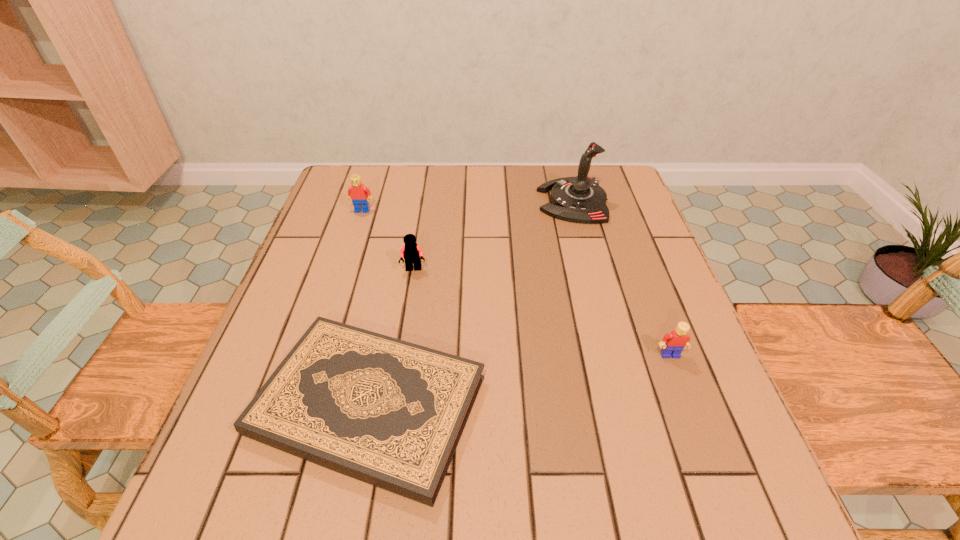
Locate an element on the screen. free spot between the rightmost Lego and the farthest Lego is located at coordinates (516, 282).

Where is `unoccupied position between the hardback book and the nearest Lego`? unoccupied position between the hardback book and the nearest Lego is located at coordinates (519, 380).

Where is `vacant space in between the tallest object and the rightmost Lego`? The width and height of the screenshot is (960, 540). vacant space in between the tallest object and the rightmost Lego is located at coordinates click(x=621, y=278).

Find the location of a particular element. The height and width of the screenshot is (540, 960). free area in between the farthest Lego and the hardback book is located at coordinates (366, 308).

Identify the location of free area in between the second Lego from right to left and the farthest Lego. (388, 240).

Where is `free spot between the tallest object and the leftmost Lego`? free spot between the tallest object and the leftmost Lego is located at coordinates (468, 206).

Find the location of a particular element. The image size is (960, 540). vacant space in between the nearest Lego and the farthest Lego is located at coordinates (516, 282).

In order to click on free space between the shortest object and the farthest Lego in this screenshot , I will do `click(366, 308)`.

Identify which object is located as the nearest to the rightmost Lego. Please provide its 2D coordinates. Your answer should be formatted as a tuple, i.e. [(x, y)], where the tuple contains the x and y coordinates of a point satisfying the conditions above.

[(390, 413)]

Locate which object is the third closest to the hardback book. Please provide its 2D coordinates. Your answer should be formatted as a tuple, i.e. [(x, y)], where the tuple contains the x and y coordinates of a point satisfying the conditions above.

[(580, 199)]